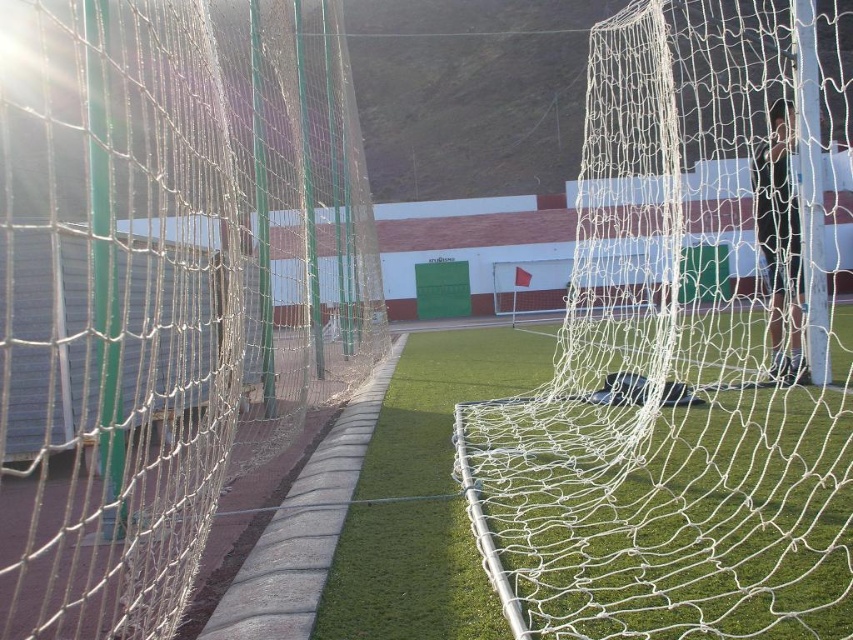
You are a soccer player standing at the edge of the artificial turf. You see the white mesh net at center and the black fabric man at center. Which object is positioned to the right of the other?

The white mesh net at center is to the right of the black fabric man at center.

You are a soccer player standing at the edge of the artificial turf near the white mesh net at center and the black fabric man at center. You want to kick the ball through the goal. Which object should you aim for to score a goal?

The white mesh net at center is part of the goal structure, so you should aim for the white mesh net at center to score a goal.